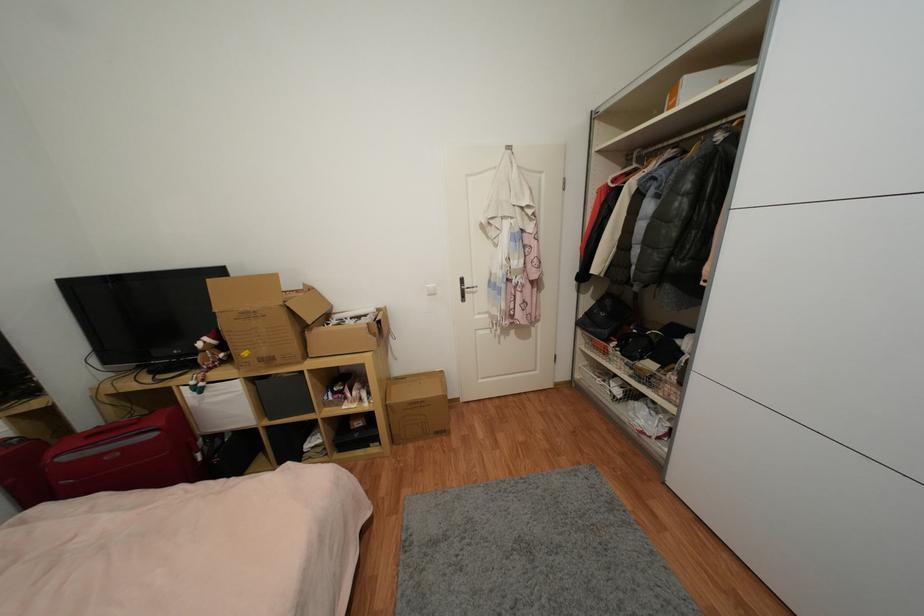
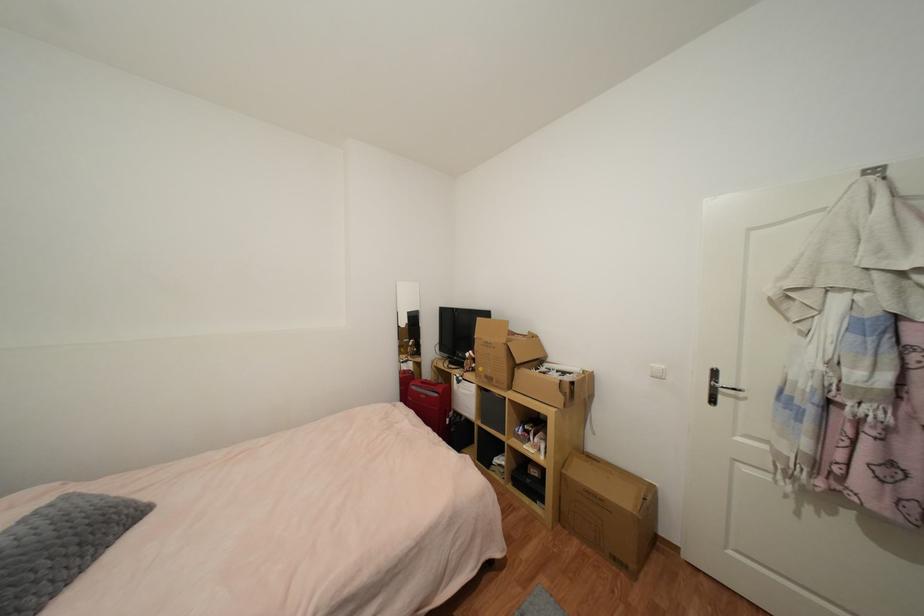
Question: I am providing you with two images of the same scene from different viewpoints. After the viewpoint changes to image2, which objects are now occluded?

Choices:
 (A) white fabric bin
 (B) cardboard box
 (C) white light switch
 (D) none of these

Answer: (D)